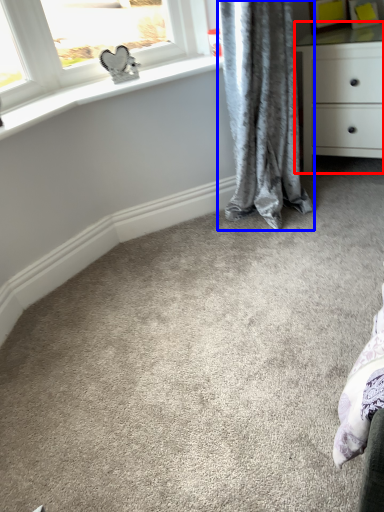
Question: Among these objects, which one is farthest to the camera, chest of drawers (highlighted by a red box) or curtain (highlighted by a blue box)?

Choices:
 (A) chest of drawers
 (B) curtain

Answer: (A)